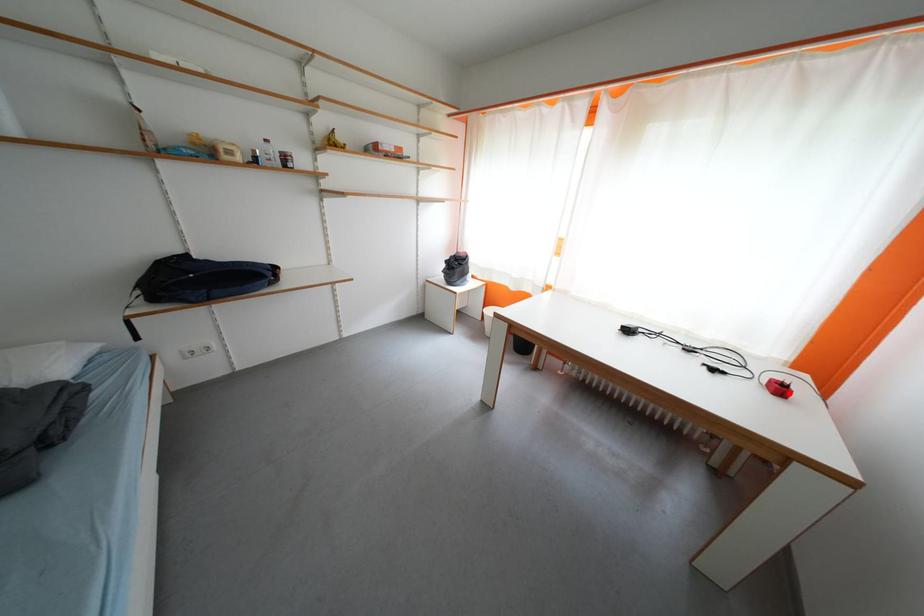
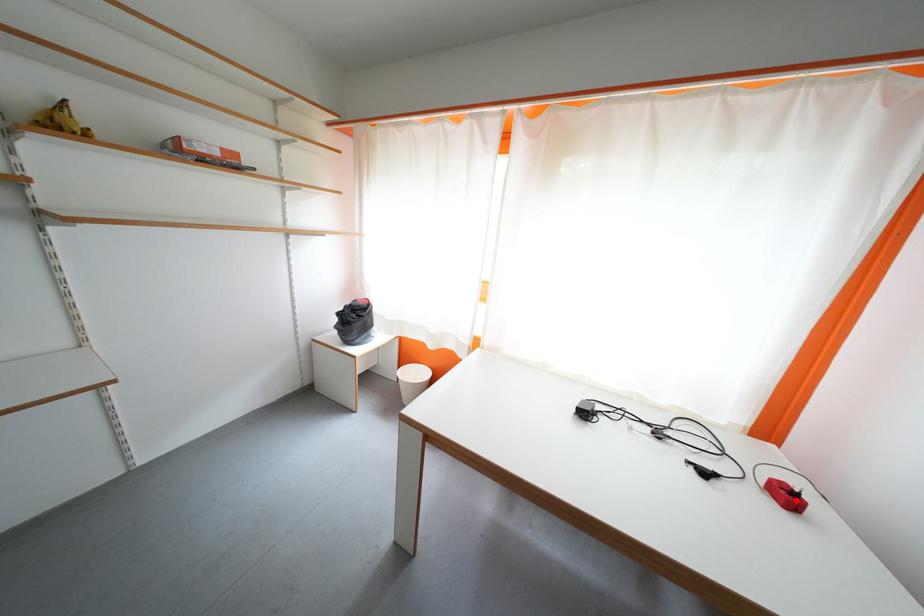
I am providing you with two images of the same scene from different viewpoints. A red point is marked on the first image and another point is marked on the second image. Do the highlighted points in image1 and image2 indicate the same real-world spot?

Yes